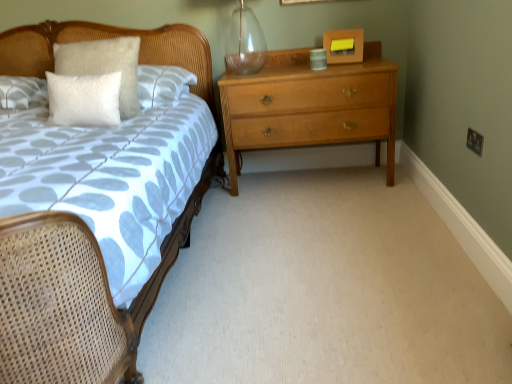
Question: Is wooden bed at left far away from transparent glass vase at upper center?

Choices:
 (A) no
 (B) yes

Answer: (A)

Question: Does wooden bed at left have a lesser width compared to transparent glass vase at upper center?

Choices:
 (A) no
 (B) yes

Answer: (A)

Question: Does wooden bed at left have a lesser height compared to transparent glass vase at upper center?

Choices:
 (A) yes
 (B) no

Answer: (B)

Question: From the image's perspective, is wooden bed at left below transparent glass vase at upper center?

Choices:
 (A) yes
 (B) no

Answer: (A)

Question: Is wooden bed at left not within transparent glass vase at upper center?

Choices:
 (A) no
 (B) yes

Answer: (B)

Question: From a real-world perspective, relative to white textured pillow at upper left, is white fluffy pillow at upper left vertically above or below?

Choices:
 (A) above
 (B) below

Answer: (B)

Question: Considering the relative positions of white fluffy pillow at upper left and white textured pillow at upper left in the image provided, is white fluffy pillow at upper left to the left or to the right of white textured pillow at upper left?

Choices:
 (A) left
 (B) right

Answer: (A)

Question: Is point (116, 72) closer or farther from the camera than point (204, 66)?

Choices:
 (A) closer
 (B) farther

Answer: (A)

Question: In terms of height, does white fluffy pillow at upper left look taller or shorter compared to white textured pillow at upper left?

Choices:
 (A) short
 (B) tall

Answer: (A)

Question: Looking at the image, does white textured pillow at upper left seem bigger or smaller compared to white fluffy pillow at upper left?

Choices:
 (A) big
 (B) small

Answer: (A)

Question: Considering the positions of white textured pillow at upper left and white fluffy pillow at upper left in the image, is white textured pillow at upper left wider or thinner than white fluffy pillow at upper left?

Choices:
 (A) wide
 (B) thin

Answer: (A)

Question: Does point (53, 31) appear closer or farther from the camera than point (113, 112)?

Choices:
 (A) farther
 (B) closer

Answer: (A)

Question: Do you think white textured pillow at upper left is within white fluffy pillow at upper left, or outside of it?

Choices:
 (A) outside
 (B) inside

Answer: (A)

Question: From the image's perspective, relative to transparent glass vase at upper center, is light brown wood chest of drawers at center above or below?

Choices:
 (A) above
 (B) below

Answer: (B)

Question: From a real-world perspective, is light brown wood chest of drawers at center physically located above or below transparent glass vase at upper center?

Choices:
 (A) above
 (B) below

Answer: (B)